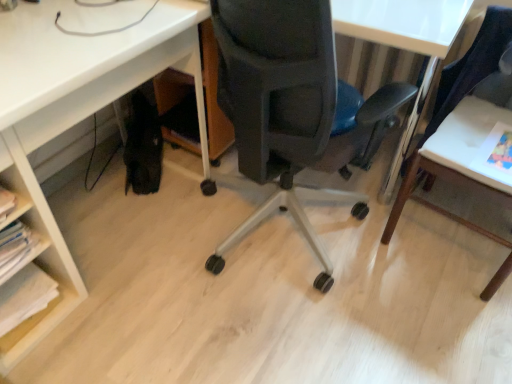
Describe the element at coordinates (292, 105) in the screenshot. I see `matte black chair at center` at that location.

The height and width of the screenshot is (384, 512). What do you see at coordinates (25, 296) in the screenshot? I see `white paper at lower left` at bounding box center [25, 296].

What is the approximate width of white paper at lower left?

It is 22.18 centimeters.

Locate an element on the screen. This screenshot has height=384, width=512. white wood table at right is located at coordinates (455, 161).

You are a GUI agent. You are given a task and a screenshot of the screen. Output one action in this format:
    pyautogui.click(x=<x>, y=<y>)
    Task: Click on the white matte desk at lower left
    The height and width of the screenshot is (384, 512).
    Given the screenshot: What is the action you would take?
    pyautogui.click(x=78, y=103)

Locate an element on the screen. This screenshot has height=384, width=512. matte black chair at center is located at coordinates tap(292, 105).

From the image's perspective, would you say white matte desk at lower left is positioned over white paper at lower left?

Yes, from the image's perspective, white matte desk at lower left is on top of white paper at lower left.

Which is behind, point (9, 139) or point (12, 318)?

The point (12, 318) is farther.

At what (x,y) coordinates should I click in order to perform the action: click on table to the right of white paper at lower left. Please return your answer as a coordinate pair (x, y). Looking at the image, I should click on (455, 161).

Are white paper at lower left and white wood table at right far apart?

Absolutely, white paper at lower left is distant from white wood table at right.

From the picture: Which of these two, white paper at lower left or white wood table at right, stands taller?

white wood table at right.

Considering the points (31, 294) and (481, 122), which point is behind, point (31, 294) or point (481, 122)?

Point (481, 122)

Considering the relative sizes of white paper at lower left and matte black chair at center in the image provided, is white paper at lower left taller than matte black chair at center?

No.

From the image's perspective, which is above, white paper at lower left or matte black chair at center?

matte black chair at center, from the image's perspective.

Between white paper at lower left and matte black chair at center, which one appears on the left side from the viewer's perspective?

From the viewer's perspective, white paper at lower left appears more on the left side.

Considering their positions, is white paper at lower left located in front of or behind matte black chair at center?

Clearly, white paper at lower left is behind matte black chair at center.

This screenshot has height=384, width=512. In order to click on chair on the right side of white matte desk at lower left in this screenshot , I will do `click(292, 105)`.

Looking at the image, does matte black chair at center seem bigger or smaller compared to white matte desk at lower left?

matte black chair at center is smaller than white matte desk at lower left.

From a real-world perspective, between matte black chair at center and white matte desk at lower left, who is vertically lower?

white matte desk at lower left is physically lower.

Can you tell me how much matte black chair at center and white matte desk at lower left differ in facing direction?

The facing directions of matte black chair at center and white matte desk at lower left are 90.5 degrees apart.

In terms of size, does white matte desk at lower left appear bigger or smaller than matte black chair at center?

white matte desk at lower left is bigger than matte black chair at center.

Considering the sizes of objects white matte desk at lower left and matte black chair at center in the image provided, who is thinner, white matte desk at lower left or matte black chair at center?

white matte desk at lower left.

How many degrees apart are the facing directions of white matte desk at lower left and matte black chair at center?

The angle between the facing direction of white matte desk at lower left and the facing direction of matte black chair at center is 90.5 degrees.

Is the position of white matte desk at lower left less distant than that of matte black chair at center?

No, white matte desk at lower left is further to the viewer.

In the scene shown: Does matte black chair at center touch white wood table at right?

matte black chair at center and white wood table at right are clearly separated.

How many degrees apart are the facing directions of matte black chair at center and white wood table at right?

173 degrees separate the facing orientations of matte black chair at center and white wood table at right.

Considering the points (347, 171) and (501, 272), which point is in front, point (347, 171) or point (501, 272)?

The point (347, 171) is closer.

Where is `chair that is in front of the white wood table at right`? chair that is in front of the white wood table at right is located at coordinates (292, 105).

From the image's perspective, is matte black chair at center beneath white paper at lower left?

No, from the image's perspective, matte black chair at center is not beneath white paper at lower left.

Would you consider matte black chair at center to be distant from white paper at lower left?

No, matte black chair at center is not far away from white paper at lower left.

Is matte black chair at center further to the viewer compared to white paper at lower left?

No, it is not.

How many degrees apart are the facing directions of matte black chair at center and white paper at lower left?

There is a 90.5-degree angle between the facing directions of matte black chair at center and white paper at lower left.

Locate an element on the screen. The width and height of the screenshot is (512, 384). desk in front of the white paper at lower left is located at coordinates (78, 103).

Find the location of a particular element. book that is behind the white wood table at right is located at coordinates (25, 296).

Estimate the real-world distances between objects in this image. Which object is closer to white wood table at right, matte black chair at center or white paper at lower left?

Among the two, matte black chair at center is located nearer to white wood table at right.

Considering their positions, is white paper at lower left positioned further to white matte desk at lower left than white wood table at right?

The object further to white matte desk at lower left is white wood table at right.

Estimate the real-world distances between objects in this image. Which object is further from white wood table at right, white paper at lower left or matte black chair at center?

white paper at lower left.

Which object lies nearer to the anchor point matte black chair at center, white paper at lower left or white wood table at right?

The object closer to matte black chair at center is white wood table at right.

Which object lies nearer to the anchor point white wood table at right, matte black chair at center or white matte desk at lower left?

matte black chair at center lies closer to white wood table at right than the other object.

Looking at the image, which one is located further to matte black chair at center, white wood table at right or white matte desk at lower left?

white matte desk at lower left is positioned further to the anchor matte black chair at center.

Considering their positions, is white wood table at right positioned further to white matte desk at lower left than matte black chair at center?

The object further to white matte desk at lower left is white wood table at right.

Estimate the real-world distances between objects in this image. Which object is further from white matte desk at lower left, matte black chair at center or white wood table at right?

Based on the image, white wood table at right appears to be further to white matte desk at lower left.

Find the location of a particular element. The image size is (512, 384). desk between white paper at lower left and matte black chair at center is located at coordinates (78, 103).

Where is `chair between white matte desk at lower left and white wood table at right`? Image resolution: width=512 pixels, height=384 pixels. chair between white matte desk at lower left and white wood table at right is located at coordinates (292, 105).

Where is `chair situated between white paper at lower left and white wood table at right from left to right`? chair situated between white paper at lower left and white wood table at right from left to right is located at coordinates (292, 105).

Identify the location of desk between white paper at lower left and white wood table at right in the horizontal direction. This screenshot has width=512, height=384. (78, 103).